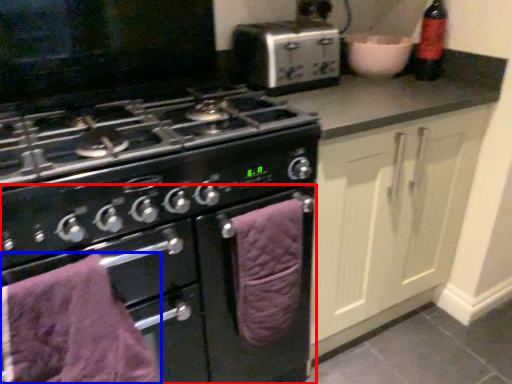
Question: Which object is further to the camera taking this photo, oven (highlighted by a red box) or bath towel (highlighted by a blue box)?

Choices:
 (A) oven
 (B) bath towel

Answer: (A)